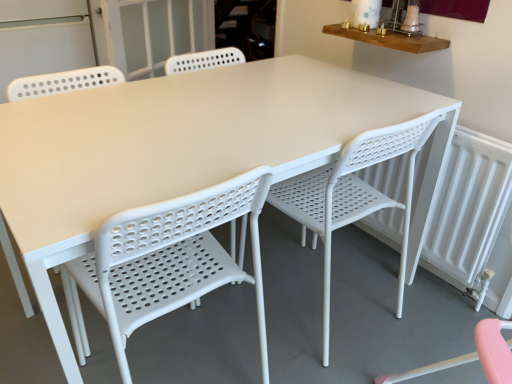
Find the location of `free spot below white plastic chair at center, placed as the second chair when sorted from left to right (from a real-world perspective)`. free spot below white plastic chair at center, placed as the second chair when sorted from left to right (from a real-world perspective) is located at coordinates (316, 298).